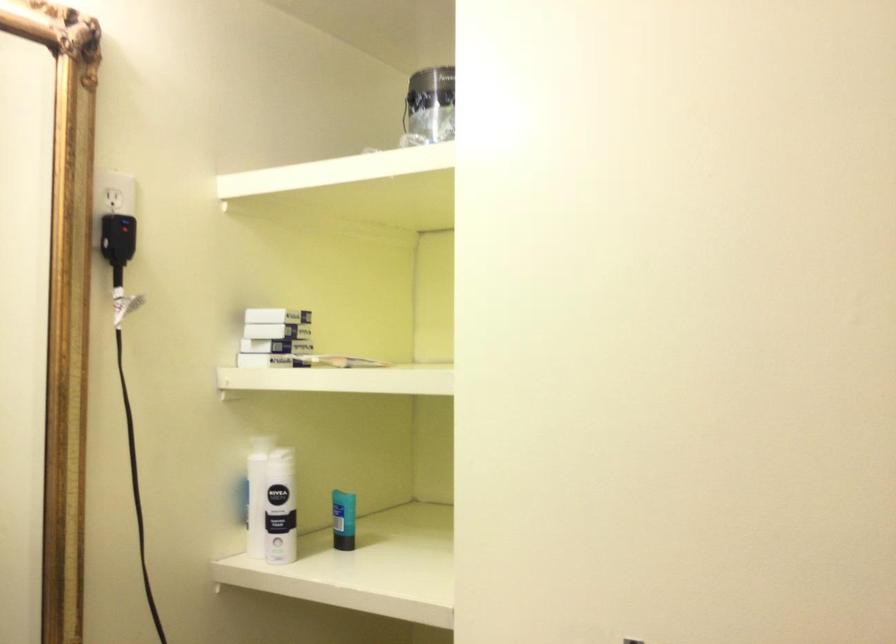
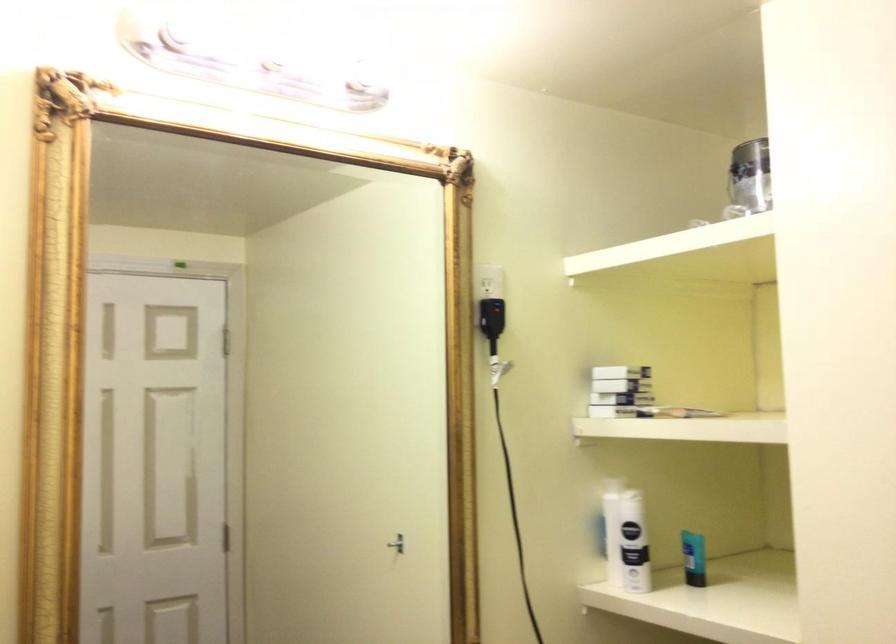
The point at (119, 384) is marked in the first image. Where is the corresponding point in the second image?

(504, 431)